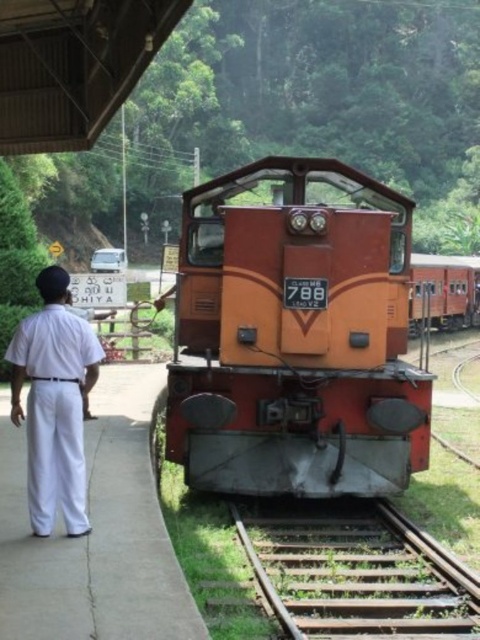
You are a railway engineer checking the safety of the tracks. The orange matte train at center is about to pass through the green grassy train track at center. Based on their widths, do you think the train will fit on the track?

The green grassy train track at center is narrower than the orange matte train at center, so the train will not fit on the track. Immediate action is required to prevent derailment.

You are standing at the railway station and want to determine the relative positions of two points marked on the locomotive. Which point is closer to you, point (219, 186) or point (60, 285)?

Point (60, 285) is closer to you because the description states that point (219, 186) is further to the camera than point (60, 285).

You are standing at the railway station near the vintage diesel locomotive numbered 788. Where is the green grassy train track at center located in relation to the locomotive?

The green grassy train track at center is located at point (358,576) relative to the locomotive.